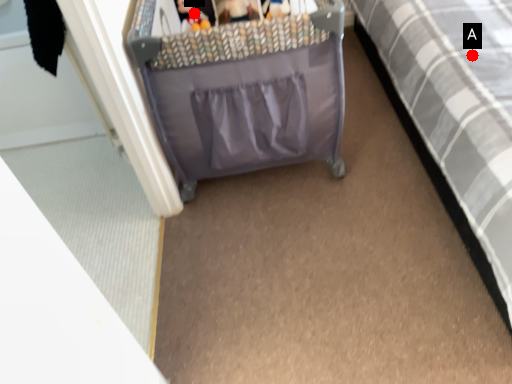
Question: Two points are circled on the image, labeled by A and B beside each circle. Which of the following is the farthest from the observer?

Choices:
 (A) A is further
 (B) B is further

Answer: (A)